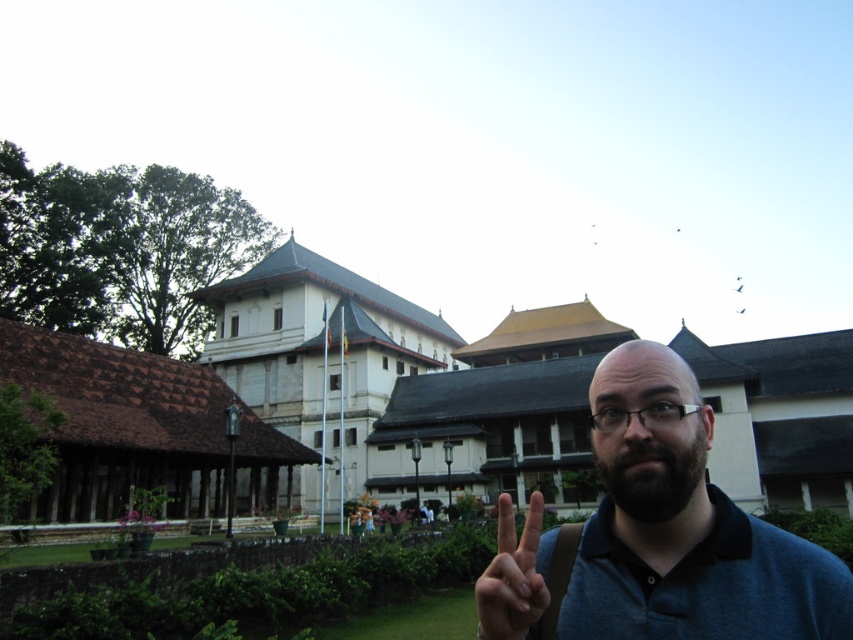
Question: Considering the real-world distances, which object is farthest from the matte skin hand at center?

Choices:
 (A) brown tiled roof at lower left
 (B) dark blue shirt at center
 (C) white stone palace at upper left
 (D) dark brown thick beard at center

Answer: (C)

Question: Which object is farther from the camera taking this photo?

Choices:
 (A) white stone palace at upper left
 (B) dark blue shirt at center
 (C) dark brown thick beard at center
 (D) matte skin hand at center

Answer: (A)

Question: Is brown tiled roof at lower left positioned before matte skin hand at center?

Choices:
 (A) yes
 (B) no

Answer: (B)

Question: Is white stone palace at upper left closer to the viewer compared to dark brown thick beard at center?

Choices:
 (A) yes
 (B) no

Answer: (B)

Question: Which of the following is the farthest from the observer?

Choices:
 (A) (177, 401)
 (B) (675, 497)
 (C) (660, 572)

Answer: (A)

Question: Is brown tiled roof at lower left thinner than dark brown thick beard at center?

Choices:
 (A) yes
 (B) no

Answer: (B)